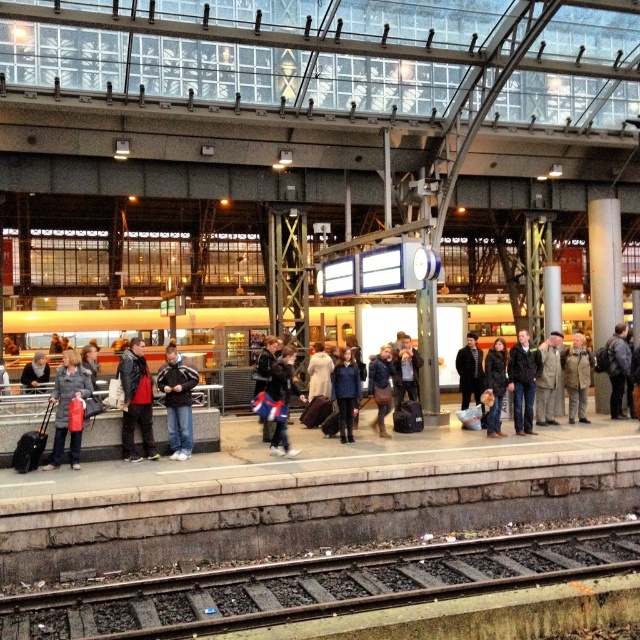
Can you confirm if metallic silver train at center is bigger than dark blue jeans at center?

Indeed, metallic silver train at center has a larger size compared to dark blue jeans at center.

Measure the distance between metallic silver train at center and dark blue jeans at center.

The distance of metallic silver train at center from dark blue jeans at center is 44.21 feet.

What do you see at coordinates (83, 321) in the screenshot? Image resolution: width=640 pixels, height=640 pixels. I see `metallic silver train at center` at bounding box center [83, 321].

Identify the location of metallic silver train at center. The image size is (640, 640). (83, 321).

Can you confirm if metallic silver train at center is taller than matte black jacket at center?

Yes.

Which is more to the right, metallic silver train at center or matte black jacket at center?

metallic silver train at center is more to the right.

Between point (100, 330) and point (56, 460), which one is positioned in front?

Point (56, 460) is more forward.

Find the location of `metallic silver train at center`. metallic silver train at center is located at coordinates (83, 321).

This screenshot has height=640, width=640. Describe the element at coordinates (83, 321) in the screenshot. I see `metallic silver train at center` at that location.

This screenshot has width=640, height=640. Identify the location of metallic silver train at center. (83, 321).